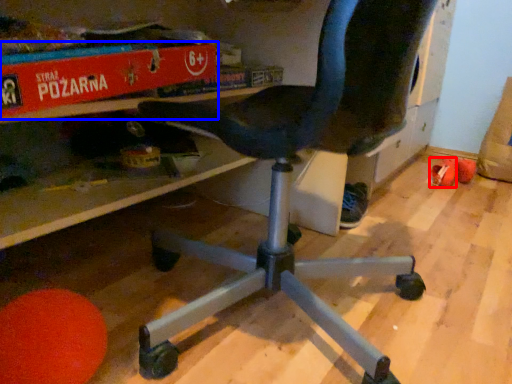
Question: Which of the following is the farthest to the observer, footwear (highlighted by a red box) or paperback book (highlighted by a blue box)?

Choices:
 (A) footwear
 (B) paperback book

Answer: (A)